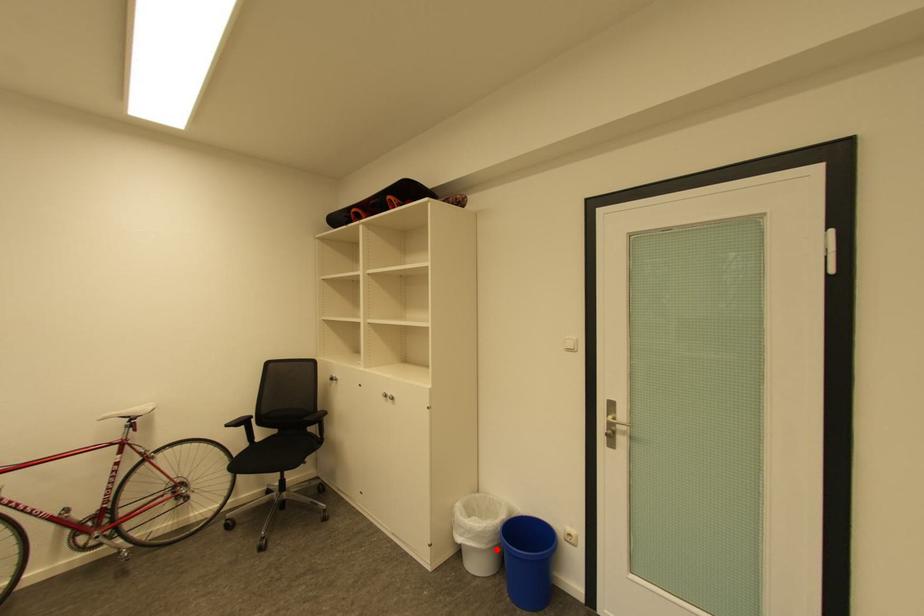
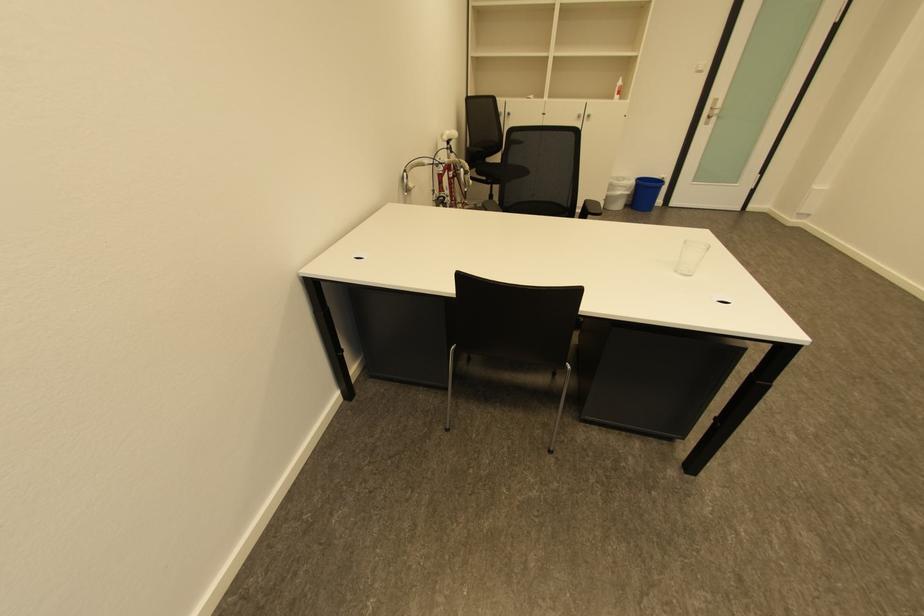
Question: I am providing you with two images of the same scene from different viewpoints. Image1 has a red point marked. In image2, the corresponding 3D location appears at what relative position? Reply with the corresponding letter.

Choices:
 (A) Closer
 (B) Farther

Answer: (A)